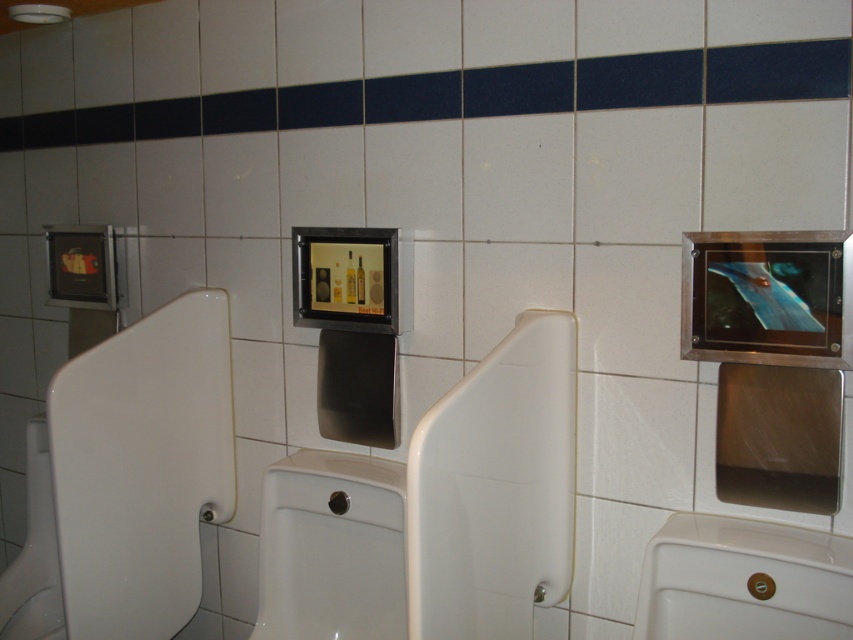
You are standing in the restroom and want to determine which point is closer to you. The points are labeled as point 1 at coordinates point (531,604) and point 2 at coordinates point (666,634). Which point is closer?

Point (531,604) is closer to you than point (666,634).

You are standing in a public restroom and need to locate the white glossy urinal at left. According to the coordinates provided, where exactly is it positioned?

The white glossy urinal at left is positioned at point (141, 467).